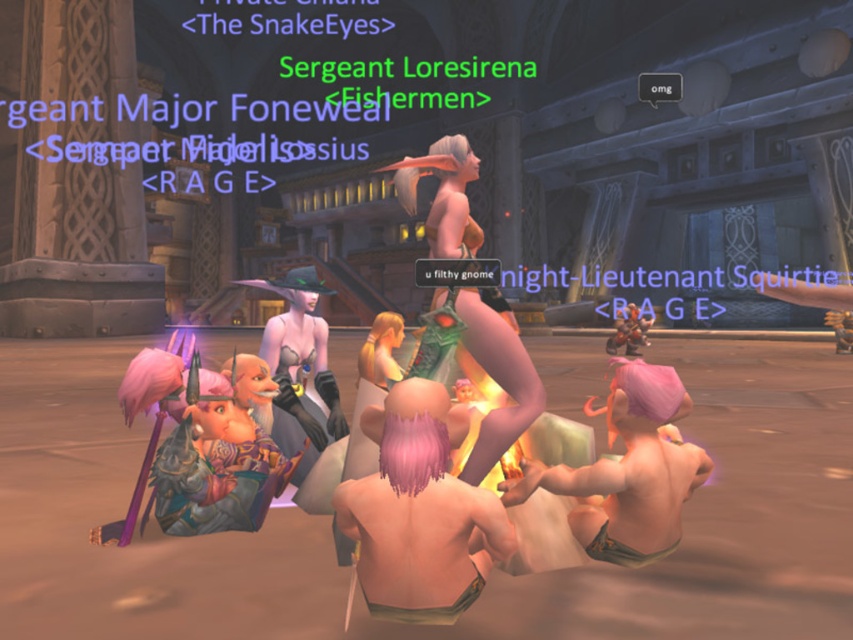
Question: Among these objects, which one is nearest to the camera?

Choices:
 (A) pink fabric gnome at lower right
 (B) blonde hair at center

Answer: (A)

Question: Considering the relative positions of pink fabric gnome at lower right and shiny purple armor at center in the image provided, where is pink fabric gnome at lower right located with respect to shiny purple armor at center?

Choices:
 (A) above
 (B) below

Answer: (B)

Question: Which object appears farthest from the camera in this image?

Choices:
 (A) pink fabric gnome at lower right
 (B) shiny purple armor at center
 (C) green leather armor at center
 (D) pink hair at center

Answer: (C)

Question: Which point is closer to the camera?

Choices:
 (A) pink hair at center
 (B) shiny purple armor at center
 (C) blonde hair at center
 (D) green leather armor at center

Answer: (A)

Question: Can you confirm if pink fabric gnome at lower right is wider than blonde hair at center?

Choices:
 (A) no
 (B) yes

Answer: (B)

Question: Does shiny purple armor at center have a smaller size compared to green leather armor at center?

Choices:
 (A) no
 (B) yes

Answer: (B)